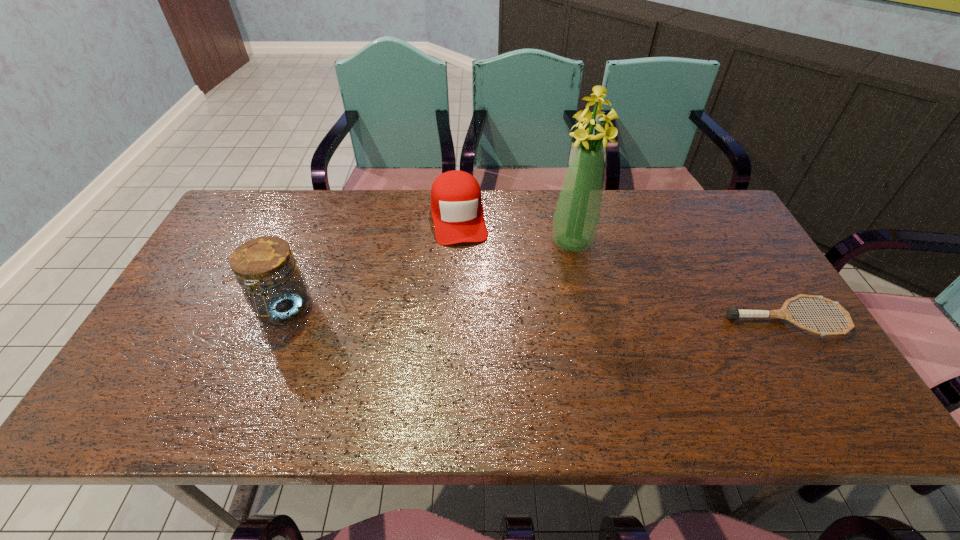
Locate an element on the screen. Image resolution: width=960 pixels, height=540 pixels. vacant point located between the tennis racket and the bouquet is located at coordinates (679, 280).

Find the location of a particular element. The width and height of the screenshot is (960, 540). free spot between the jar and the third object from right to left is located at coordinates (372, 263).

Where is `vacant area that lies between the tennis racket and the second object from left to right`? vacant area that lies between the tennis racket and the second object from left to right is located at coordinates (622, 267).

Locate an element on the screen. This screenshot has height=540, width=960. blank region between the jar and the second object from left to right is located at coordinates (372, 263).

Locate an element on the screen. unoccupied position between the tennis racket and the tallest object is located at coordinates (679, 280).

The image size is (960, 540). In order to click on object identified as the second closest to the second object from right to left in this screenshot , I will do `click(733, 313)`.

Choose which object is the nearest neighbor to the second object from left to right. Please provide its 2D coordinates. Your answer should be formatted as a tuple, i.e. [(x, y)], where the tuple contains the x and y coordinates of a point satisfying the conditions above.

[(576, 218)]

Locate an element on the screen. This screenshot has height=540, width=960. vacant space that satisfies the following two spatial constraints: 1. on the lid of the third shortest object; 2. on the left side of the tennis racket is located at coordinates (280, 319).

I want to click on vacant space that satisfies the following two spatial constraints: 1. on the front side of the third object from left to right; 2. on the right side of the second shortest object, so click(x=458, y=242).